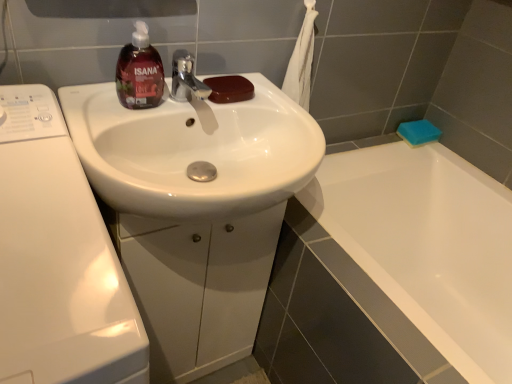
Question: In terms of size, does brown glossy soap at center, the second soap from the back, appear bigger or smaller than translucent dark red liquid soap at upper left?

Choices:
 (A) small
 (B) big

Answer: (A)

Question: From a real-world perspective, is brown glossy soap at center, which is the 1th soap in front-to-back order, above or below translucent dark red liquid soap at upper left?

Choices:
 (A) below
 (B) above

Answer: (A)

Question: Which is nearer to the blue sponge at upper right, which appears as the first soap when viewed from the back?

Choices:
 (A) translucent dark red liquid soap at upper left
 (B) white glossy cabinet at center
 (C) white glossy washing machine at left
 (D) brown glossy soap at center, the second soap from the back
 (E) white glossy sink at center

Answer: (D)

Question: Estimate the real-world distances between objects in this image. Which object is closer to the translucent dark red liquid soap at upper left?

Choices:
 (A) white glossy washing machine at left
 (B) white glossy cabinet at center
 (C) blue sponge at upper right, acting as the second soap starting from the front
 (D) white glossy sink at center
 (E) brown glossy soap at center, which is the 2th soap in right-to-left order

Answer: (E)